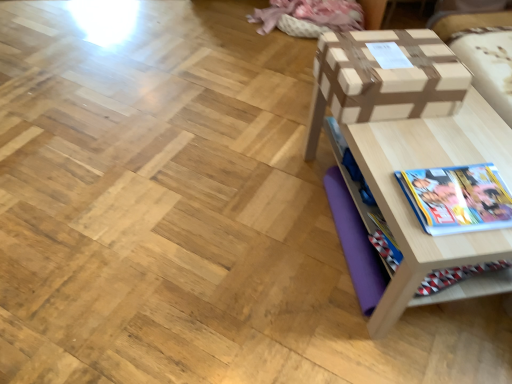
Identify the location of free space to the back side of hardcover book at lower right. (435, 144).